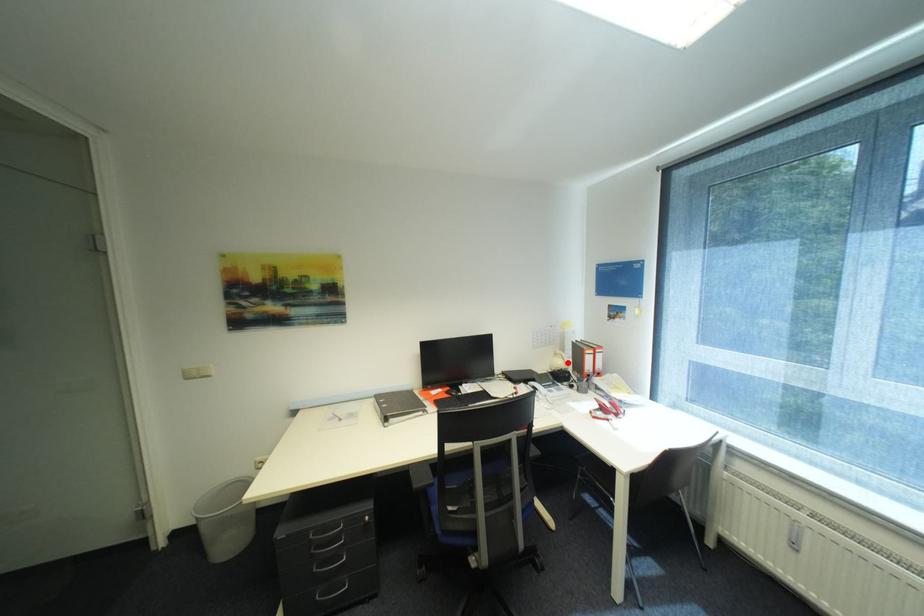
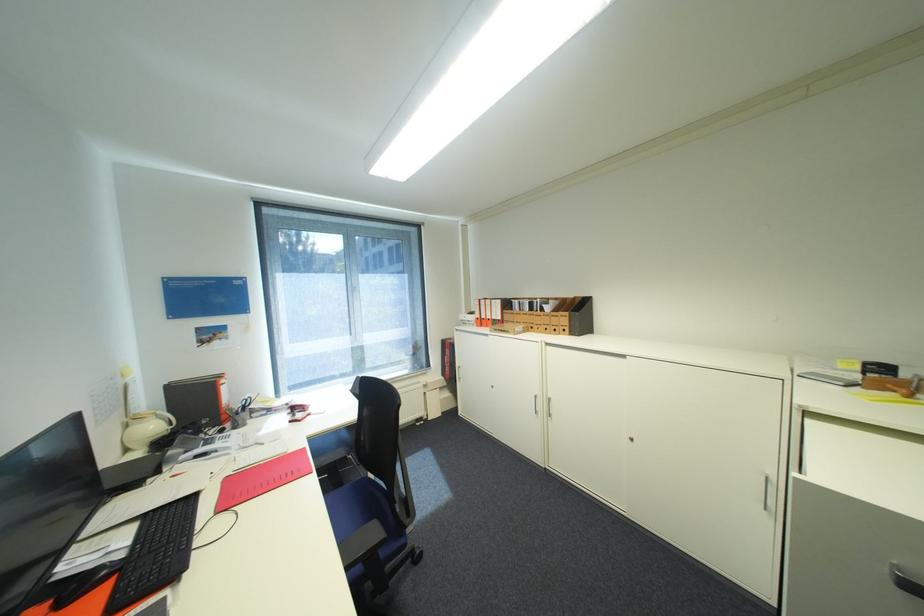
In the second image, find the point that corresponds to the highlighted location in the first image.

(161, 427)